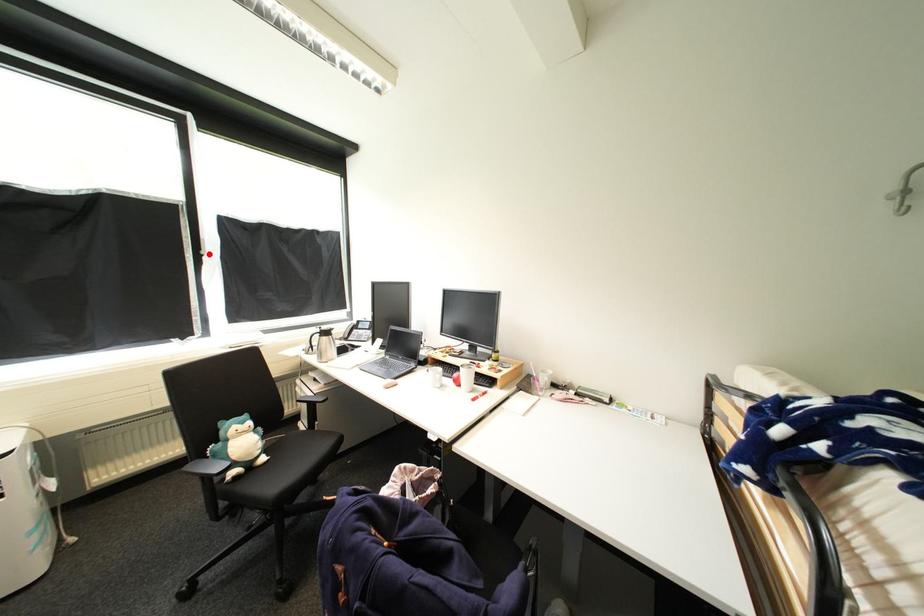
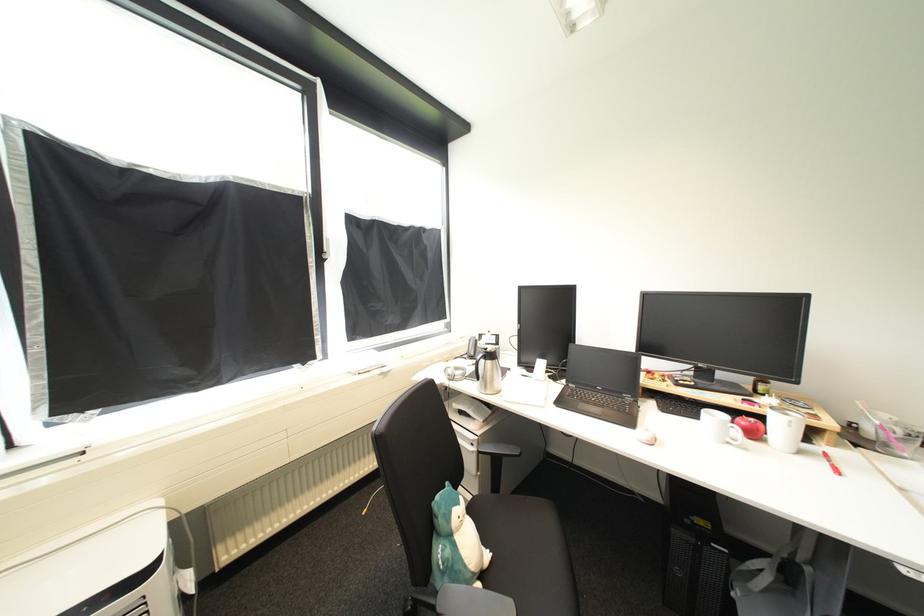
In the second image, find the point that corresponds to the highlighted location in the first image.

(331, 257)